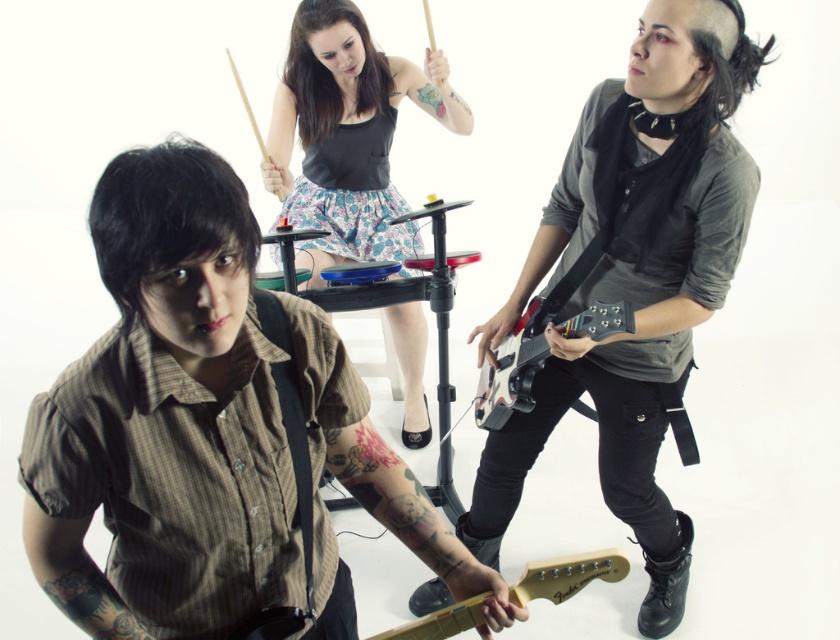
Does matte black guitar at center appear under floral skirt at center?

Correct, matte black guitar at center is located below floral skirt at center.

Where is `matte black guitar at center`? matte black guitar at center is located at coordinates (633, 276).

Is brown striped shirt at center wider than shiny black electric guitar at right?

Yes.

Can you confirm if brown striped shirt at center is positioned to the left of shiny black electric guitar at right?

Yes, brown striped shirt at center is to the left of shiny black electric guitar at right.

Find the location of a particular element. brown striped shirt at center is located at coordinates (166, 419).

Based on the photo, can you confirm if floral skirt at center is shorter than shiny black electric guitar at right?

In fact, floral skirt at center may be taller than shiny black electric guitar at right.

This screenshot has width=840, height=640. I want to click on floral skirt at center, so click(348, 134).

Find the location of a particular element. floral skirt at center is located at coordinates (348, 134).